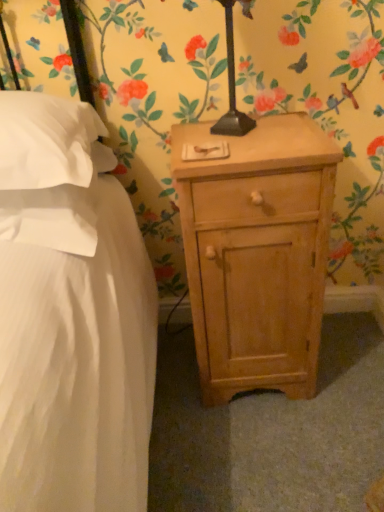
Question: From a real-world perspective, relative to white soft pillow at left, positioned as the 1th pillow in bottom-to-top order, is light wood nightstand at lower right vertically above or below?

Choices:
 (A) below
 (B) above

Answer: (A)

Question: Considering the positions of light wood nightstand at lower right and white soft pillow at left, positioned as the 1th pillow in bottom-to-top order, in the image, is light wood nightstand at lower right wider or thinner than white soft pillow at left, positioned as the 1th pillow in bottom-to-top order,?

Choices:
 (A) thin
 (B) wide

Answer: (A)

Question: Considering the real-world distances, which object is closest to the white soft pillow at left, positioned as the 1th pillow in bottom-to-top order?

Choices:
 (A) white soft pillow at left, the first pillow in the top-to-bottom sequence
 (B) light wood nightstand at lower right

Answer: (A)

Question: Which is nearer to the white soft pillow at left, the first pillow in the top-to-bottom sequence?

Choices:
 (A) white soft pillow at left, which is the 2th pillow from top to bottom
 (B) light wood nightstand at lower right

Answer: (A)